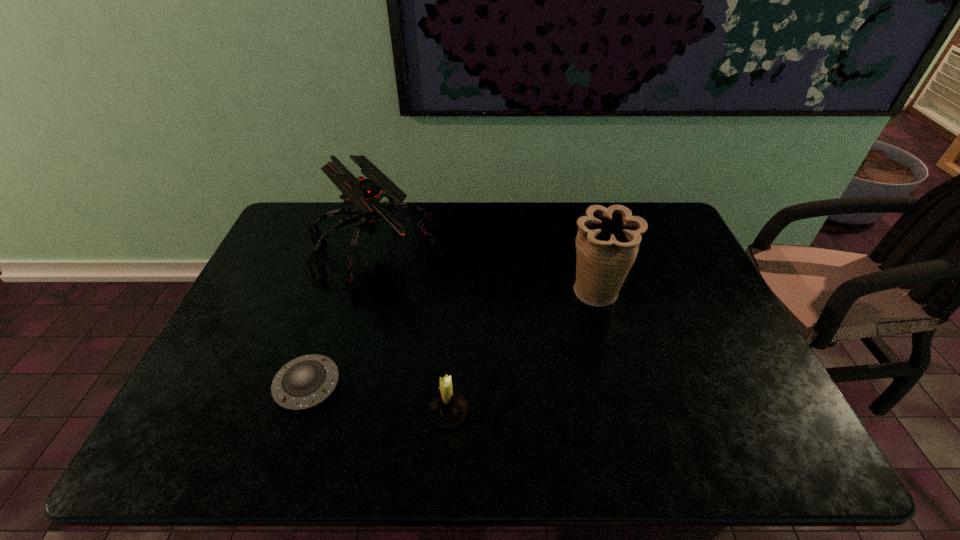
Identify the location of drone. (365, 195).

The image size is (960, 540). Find the location of `urn`. urn is located at coordinates (607, 242).

Where is `the second shortest object`? Image resolution: width=960 pixels, height=540 pixels. the second shortest object is located at coordinates (448, 409).

You are a GUI agent. You are given a task and a screenshot of the screen. Output one action in this format:
    pyautogui.click(x=<x>, y=<y>)
    Task: Click on the candle holder
    This screenshot has height=540, width=960.
    Given the screenshot: What is the action you would take?
    pyautogui.click(x=448, y=409)

Identify the location of the shortest object. This screenshot has width=960, height=540. (305, 381).

This screenshot has height=540, width=960. Find the location of `vacant space situated on the right of the drone`. vacant space situated on the right of the drone is located at coordinates (461, 248).

Where is `vacant region located 0.220m on the right of the rightmost object`? vacant region located 0.220m on the right of the rightmost object is located at coordinates (702, 293).

Where is `free location located on the back of the candle holder`? free location located on the back of the candle holder is located at coordinates (453, 327).

Identify the location of free location located on the front of the saucer. (283, 457).

At what (x,y) coordinates should I click in order to perform the action: click on object at the far edge. Please return your answer as a coordinate pair (x, y). Looking at the image, I should click on (365, 195).